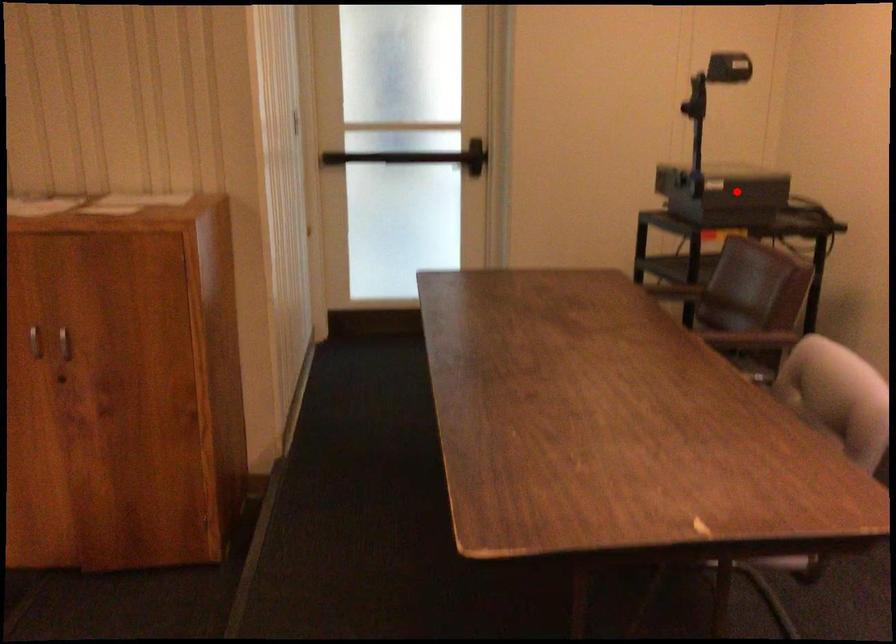
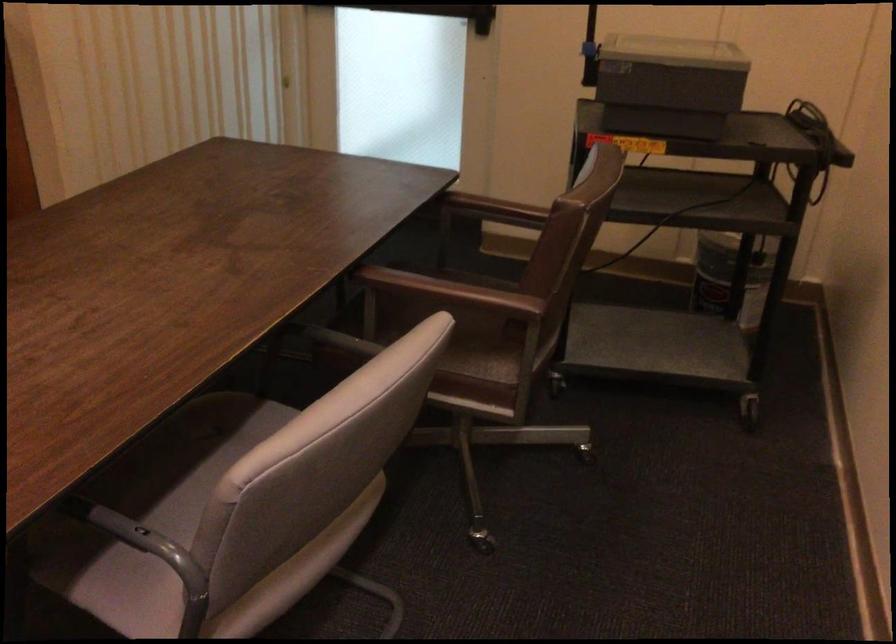
Locate, in the second image, the point that corresponds to the highlighted location in the first image.

(668, 84)